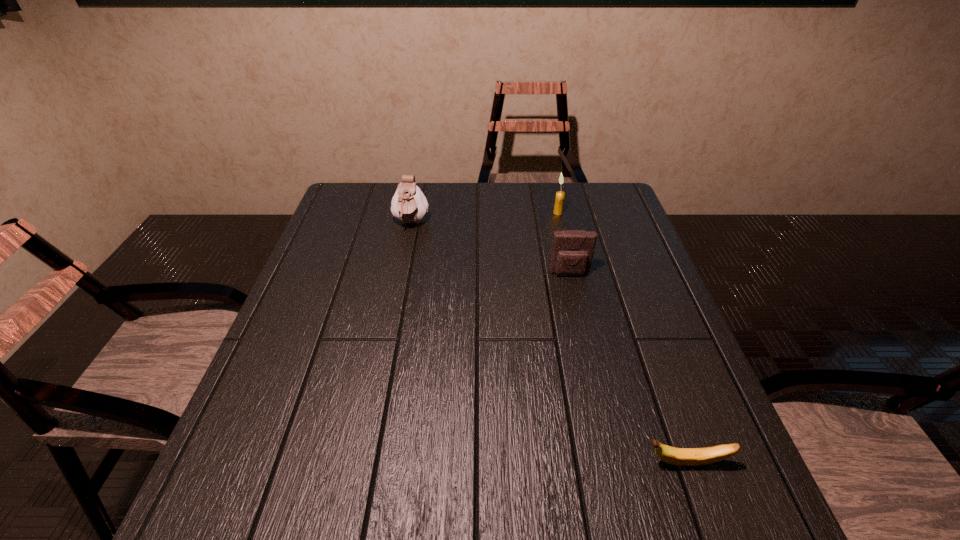
The width and height of the screenshot is (960, 540). I want to click on the left pouch, so click(x=409, y=205).

This screenshot has width=960, height=540. What are the coordinates of `the farther pouch` in the screenshot? It's located at (409, 205).

Find the location of a particular element. candle is located at coordinates (560, 195).

Where is `the second nearest object`? Image resolution: width=960 pixels, height=540 pixels. the second nearest object is located at coordinates (572, 253).

Locate an element on the screen. This screenshot has height=540, width=960. the nearer pouch is located at coordinates (572, 253).

Identify the location of the nearest object. The width and height of the screenshot is (960, 540). (676, 456).

Where is `the rightmost object`? the rightmost object is located at coordinates (676, 456).

Image resolution: width=960 pixels, height=540 pixels. What are the coordinates of `free location located 0.110m on the front-facing side of the leftmost object` in the screenshot? It's located at (403, 261).

I want to click on free spot located 0.210m on the left of the candle, so [x=487, y=213].

The image size is (960, 540). Identify the location of free location located 0.220m with an open flap on the second nearest object. (586, 345).